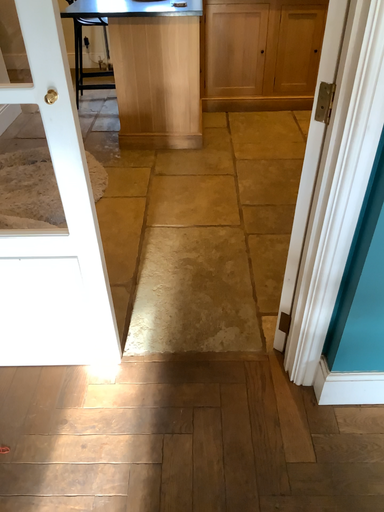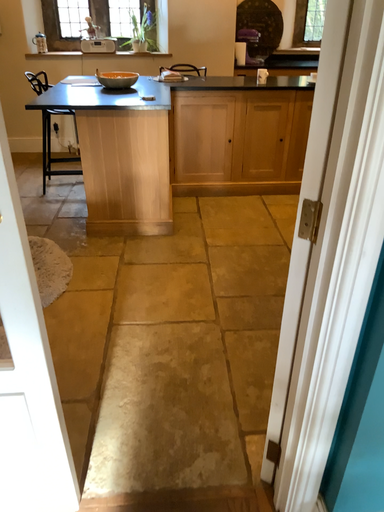
Question: How did the camera likely rotate when shooting the video?

Choices:
 (A) rotated upward
 (B) rotated downward

Answer: (A)